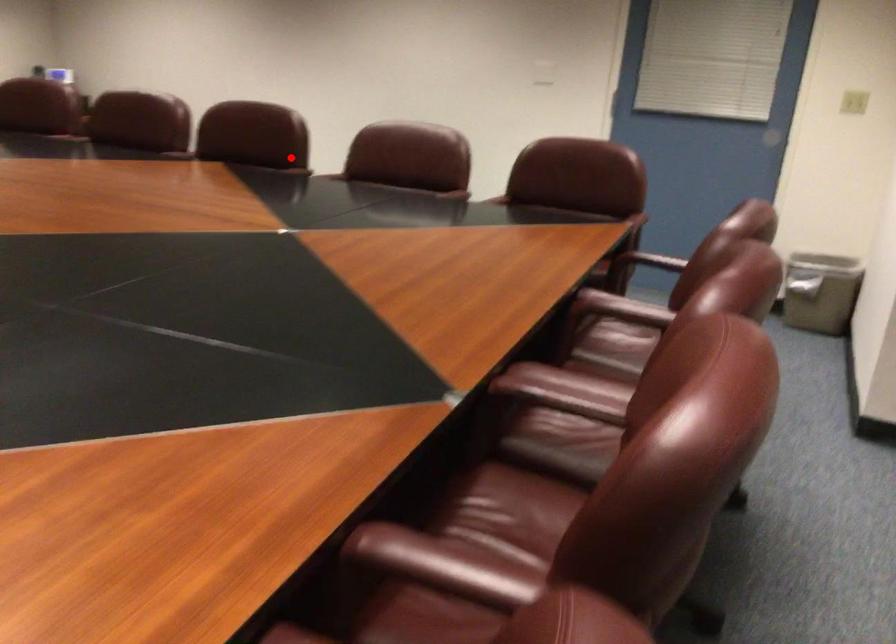
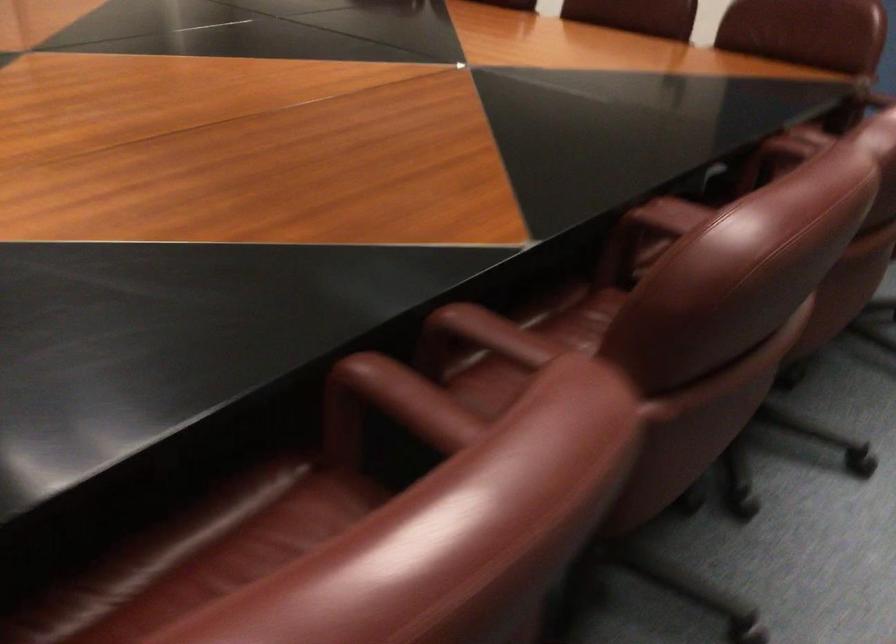
Question: I am providing you with two images of the same scene from different viewpoints. Given a red point in image1, look at the same physical point in image2. Is it:

Choices:
 (A) Closer to the viewpoint
 (B) Farther from the viewpoint

Answer: (A)